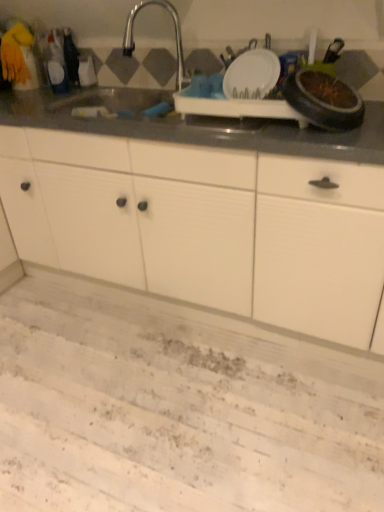
Question: In terms of height, does satin nickel faucet at upper center look taller or shorter compared to white matte cabinet at center?

Choices:
 (A) short
 (B) tall

Answer: (A)

Question: In terms of size, does satin nickel faucet at upper center appear bigger or smaller than white matte cabinet at center?

Choices:
 (A) big
 (B) small

Answer: (B)

Question: Is satin nickel faucet at upper center inside the boundaries of white matte cabinet at center, or outside?

Choices:
 (A) inside
 (B) outside

Answer: (B)

Question: In the image, is white matte cabinet at center on the left side or the right side of satin nickel faucet at upper center?

Choices:
 (A) left
 (B) right

Answer: (B)

Question: Do you think white matte cabinet at center is within satin nickel faucet at upper center, or outside of it?

Choices:
 (A) outside
 (B) inside

Answer: (A)

Question: Is white matte cabinet at center taller or shorter than satin nickel faucet at upper center?

Choices:
 (A) tall
 (B) short

Answer: (A)

Question: Considering the positions of point (x=235, y=270) and point (x=127, y=31), is point (x=235, y=270) closer or farther from the camera than point (x=127, y=31)?

Choices:
 (A) closer
 (B) farther

Answer: (A)